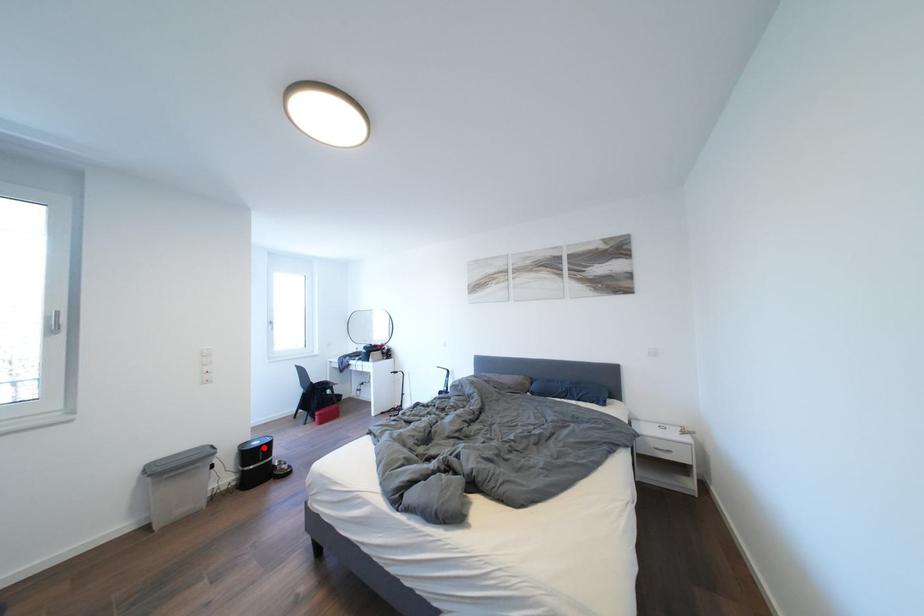
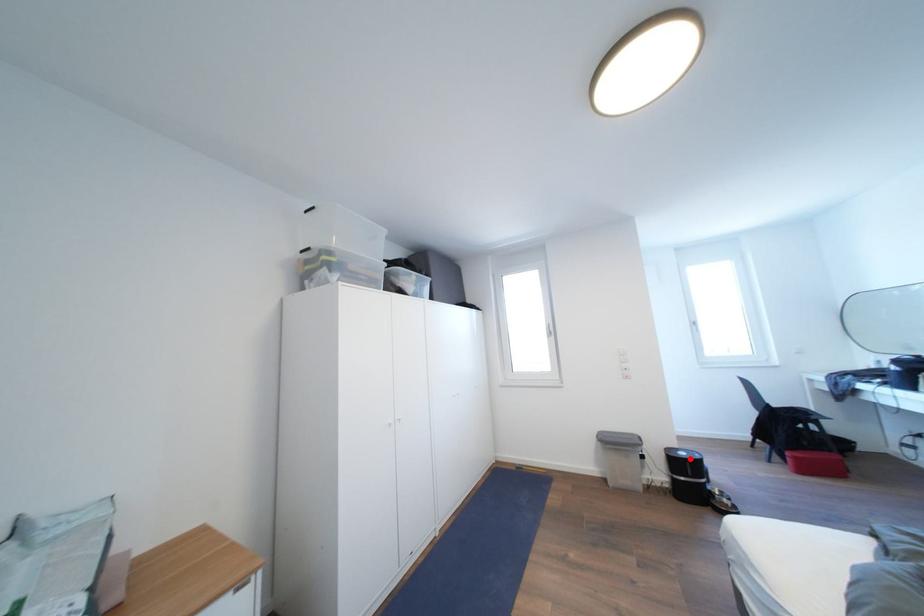
I am providing you with two images of the same scene from different viewpoints. A red point is marked on the first image and another point is marked on the second image. Is the marked point in image1 the same physical position as the marked point in image2?

Yes